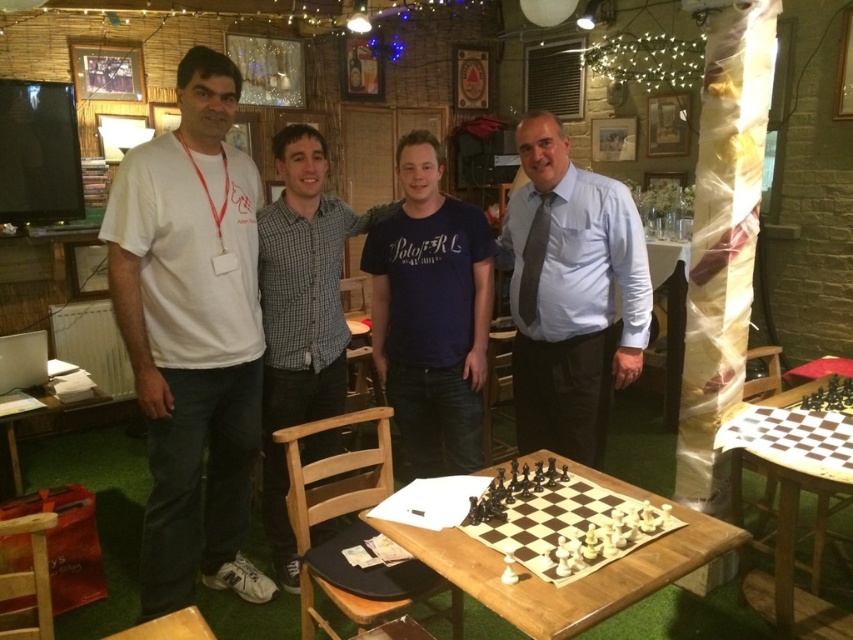
You are organizing a chess tournament and need to ensure that the checkered shirt at center and the wooden table at lower left are visible in the photo. Which object should be moved closer to the camera to ensure both are in focus?

The checkered shirt at center is positioned over wooden table at lower left, so moving the wooden table at lower left closer to the camera would bring both into focus as the shirt is already above it.

You are a photographer standing at the entrance of the room. You want to take a photo of the checkered shirt at center and the wooden table at lower left without moving any objects. Can you position yourself so that both are in the frame simultaneously?

The distance between checkered shirt at center and wooden table at lower left is 38.17 inches, so yes, you can position yourself to capture both in the frame as they are within a reasonable distance from each other.